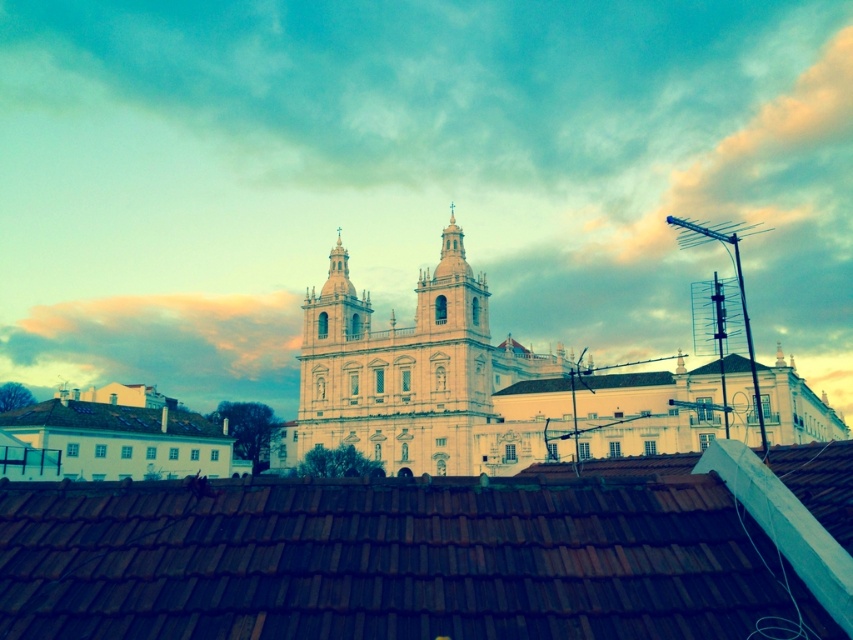
Question: Is cloudy sky at upper center bigger than brown tile roof at center?

Choices:
 (A) no
 (B) yes

Answer: (B)

Question: Is brown tile roof at center closer to camera compared to pastel pink cloud at upper center?

Choices:
 (A) yes
 (B) no

Answer: (A)

Question: Considering the real-world distances, which object is closest to the white smooth building at lower left?

Choices:
 (A) white shingles at lower left
 (B) pastel pink cloud at upper center
 (C) white smooth church at center

Answer: (A)

Question: Which object is positioned farthest from the brown tile roof at center?

Choices:
 (A) cloudy sky at upper center
 (B) white smooth church at center

Answer: (A)

Question: Can you confirm if cloudy sky at upper center is bigger than white shingles at lower left?

Choices:
 (A) yes
 (B) no

Answer: (A)

Question: Which point is closer to the camera?

Choices:
 (A) (578, 154)
 (B) (22, 364)
 (C) (782, 444)
 (D) (212, 458)

Answer: (C)